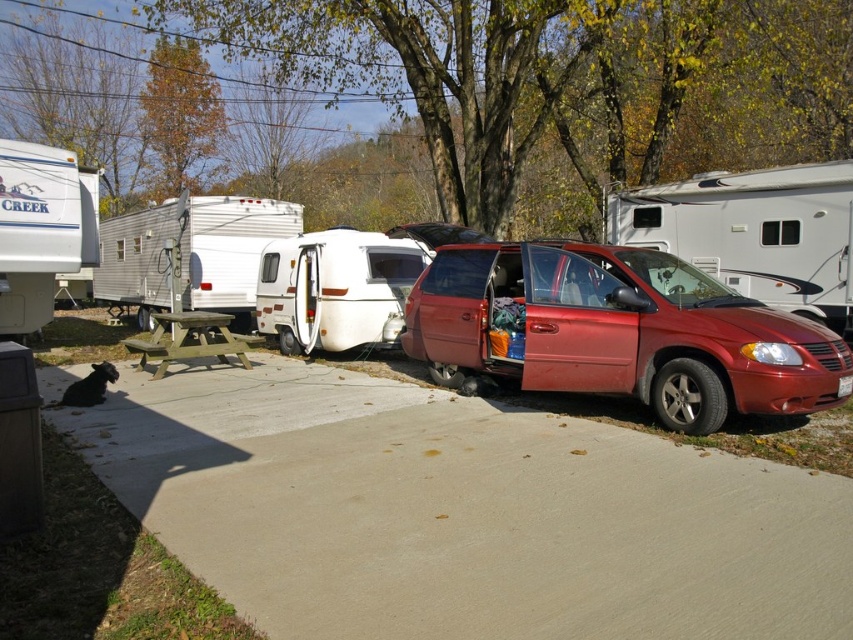
Question: Can you confirm if concrete at center is wider than matte red van at upper right?

Choices:
 (A) yes
 (B) no

Answer: (B)

Question: Which point appears farthest from the camera in this image?

Choices:
 (A) (747, 353)
 (B) (103, 276)

Answer: (B)

Question: Which of the following is the closest to the observer?

Choices:
 (A) (788, 296)
 (B) (221, 340)

Answer: (A)

Question: Is shiny red minivan at center wider than green wood picnic table at center?

Choices:
 (A) yes
 (B) no

Answer: (A)

Question: Is concrete at center in front of shiny red minivan at center?

Choices:
 (A) yes
 (B) no

Answer: (A)

Question: Among these points, which one is nearest to the camera?

Choices:
 (A) (222, 355)
 (B) (201, 211)
 (C) (625, 188)
 (D) (664, 388)

Answer: (D)